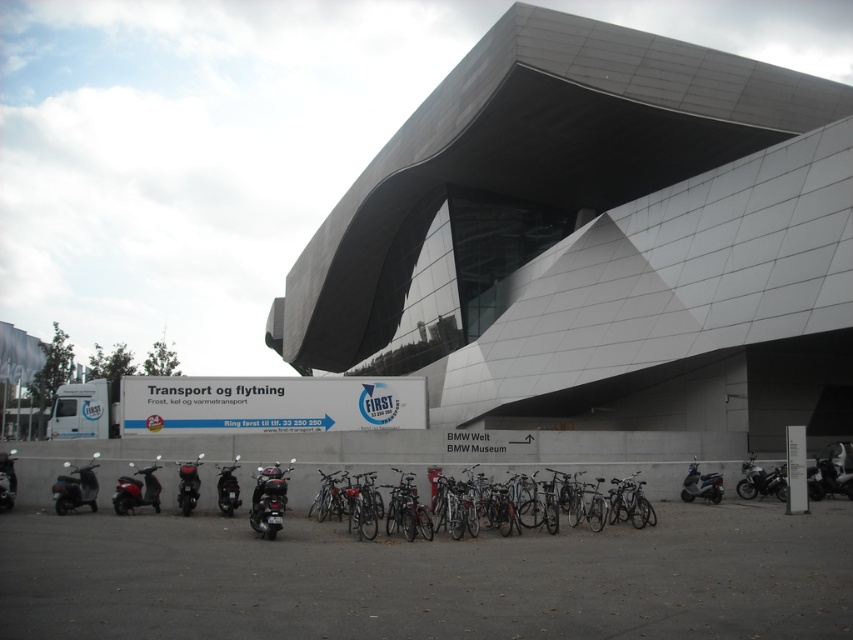
Looking at this image, who is lower down, shiny black motorcycle at center or matte black scooter at lower left?

matte black scooter at lower left is below.

Who is taller, shiny black motorcycle at center or matte black scooter at lower left?

matte black scooter at lower left is taller.

Does point (251, 528) come closer to viewer compared to point (1, 484)?

Yes.

Locate an element on the screen. The height and width of the screenshot is (640, 853). shiny black motorcycle at center is located at coordinates (270, 499).

Is metallic silver motorcycle at lower left smaller than matte black scooter at lower left?

Yes.

You are a GUI agent. You are given a task and a screenshot of the screen. Output one action in this format:
    pyautogui.click(x=<x>, y=<y>)
    Task: Click on the metallic silver motorcycle at lower left
    
    Given the screenshot: What is the action you would take?
    pyautogui.click(x=189, y=484)

The width and height of the screenshot is (853, 640). Identify the location of metallic silver motorcycle at lower left. (189, 484).

The image size is (853, 640). I want to click on metallic silver motorcycle at lower left, so click(x=189, y=484).

Who is more forward, (630, 486) or (276, 525)?

Point (276, 525)

Who is more forward, (605, 520) or (257, 506)?

Positioned in front is point (257, 506).

Where is `silver metallic bicycle at center`? The width and height of the screenshot is (853, 640). silver metallic bicycle at center is located at coordinates (535, 504).